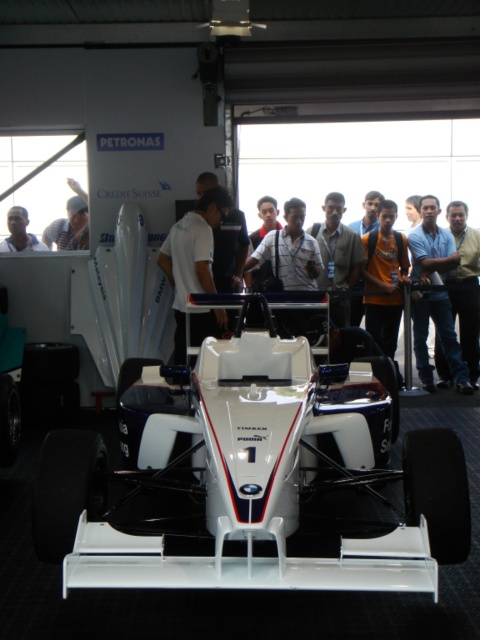
Between point (343, 321) and point (17, 230), which one is positioned behind?

Point (343, 321)

This screenshot has height=640, width=480. I want to click on light brown leather shirt at center, so click(x=336, y=246).

Image resolution: width=480 pixels, height=640 pixels. I want to click on light brown leather shirt at center, so click(336, 246).

Who is more distant from viewer, (388, 324) or (22, 250)?

Point (388, 324)

Locate an element on the screen. The height and width of the screenshot is (640, 480). orange fabric shirt at center is located at coordinates point(384,278).

Locate an element on the screen. This screenshot has width=480, height=640. orange fabric shirt at center is located at coordinates (384, 278).

In the scene shown: Measure the distance from white matte shirt at center to dark skin smooth face at center.

They are 9.12 feet apart.

Which is behind, point (248, 266) or point (17, 248)?

The point (248, 266) is behind.

The image size is (480, 640). What are the coordinates of `white matte shirt at center` in the screenshot? It's located at (289, 252).